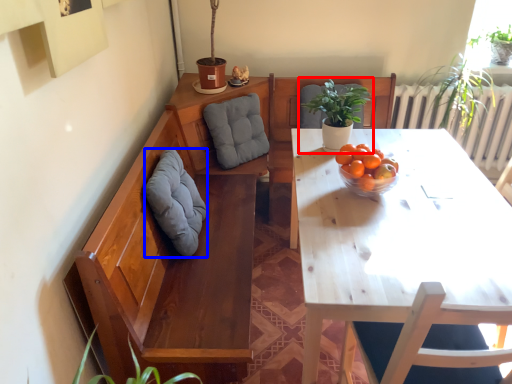
Question: Which of the following is the farthest to the observer, houseplant (highlighted by a red box) or gray (highlighted by a blue box)?

Choices:
 (A) houseplant
 (B) gray

Answer: (A)